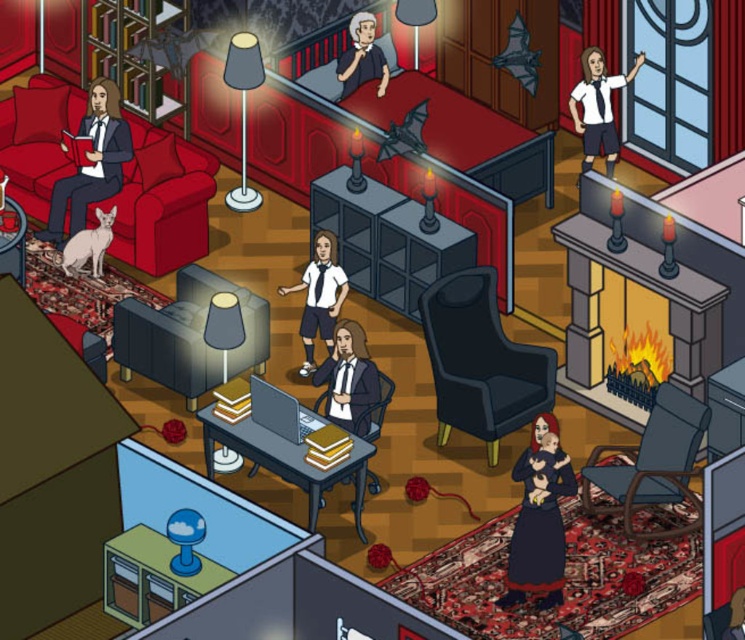
Which is above, velvet black dress at lower center or white glossy shirt at upper right?

Positioned higher is white glossy shirt at upper right.

This screenshot has height=640, width=745. What do you see at coordinates (539, 518) in the screenshot? I see `velvet black dress at lower center` at bounding box center [539, 518].

Is point (548, 433) more distant than point (589, 58)?

No.

Where is `velvet black dress at lower center`? This screenshot has height=640, width=745. velvet black dress at lower center is located at coordinates (539, 518).

Is matte black couch at left shorter than matte black chair at center?

Yes.

At what (x,y) coordinates should I click in order to perform the action: click on matte black couch at left. Please return your answer as a coordinate pair (x, y). The image size is (745, 640). Looking at the image, I should click on (161, 202).

Which is in front, point (145, 260) or point (336, 376)?

Point (336, 376) is in front.

Which is above, matte black couch at left or matte black suit at center?

matte black couch at left is above.

Who is more forward, (22,154) or (332,355)?

Point (332,355)

The height and width of the screenshot is (640, 745). I want to click on matte black couch at left, so click(161, 202).